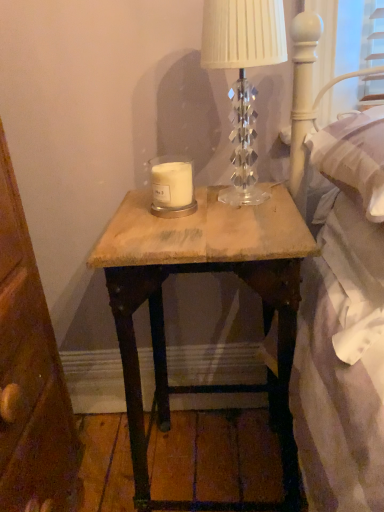
Question: Can you confirm if clear crystal lamp at upper center is positioned to the right of white matte candle at center?

Choices:
 (A) yes
 (B) no

Answer: (A)

Question: Is clear crystal lamp at upper center positioned in front of white matte candle at center?

Choices:
 (A) yes
 (B) no

Answer: (A)

Question: Is clear crystal lamp at upper center oriented away from white matte candle at center?

Choices:
 (A) yes
 (B) no

Answer: (B)

Question: Can you confirm if clear crystal lamp at upper center is wider than white matte candle at center?

Choices:
 (A) yes
 (B) no

Answer: (A)

Question: From the image's perspective, is clear crystal lamp at upper center below white matte candle at center?

Choices:
 (A) yes
 (B) no

Answer: (B)

Question: Is white matte candle at center in front of or behind wooden nightstand at center in the image?

Choices:
 (A) front
 (B) behind

Answer: (B)

Question: Visually, is white matte candle at center positioned to the left or to the right of wooden nightstand at center?

Choices:
 (A) right
 (B) left

Answer: (B)

Question: From their relative heights in the image, would you say white matte candle at center is taller or shorter than wooden nightstand at center?

Choices:
 (A) short
 (B) tall

Answer: (A)

Question: Does point (180, 192) appear closer or farther from the camera than point (183, 261)?

Choices:
 (A) farther
 (B) closer

Answer: (A)

Question: From the image's perspective, is clear crystal lamp at upper center located above or below white matte candle at center?

Choices:
 (A) below
 (B) above

Answer: (B)

Question: Considering the relative positions of clear crystal lamp at upper center and white matte candle at center in the image provided, is clear crystal lamp at upper center to the left or to the right of white matte candle at center?

Choices:
 (A) right
 (B) left

Answer: (A)

Question: From a real-world perspective, is clear crystal lamp at upper center above or below white matte candle at center?

Choices:
 (A) above
 (B) below

Answer: (A)

Question: Considering the positions of clear crystal lamp at upper center and white matte candle at center in the image, is clear crystal lamp at upper center wider or thinner than white matte candle at center?

Choices:
 (A) wide
 (B) thin

Answer: (A)

Question: Considering the positions of point (253, 208) and point (182, 190), is point (253, 208) closer or farther from the camera than point (182, 190)?

Choices:
 (A) farther
 (B) closer

Answer: (B)

Question: In terms of width, does wooden nightstand at center look wider or thinner when compared to white matte candle at center?

Choices:
 (A) wide
 (B) thin

Answer: (A)